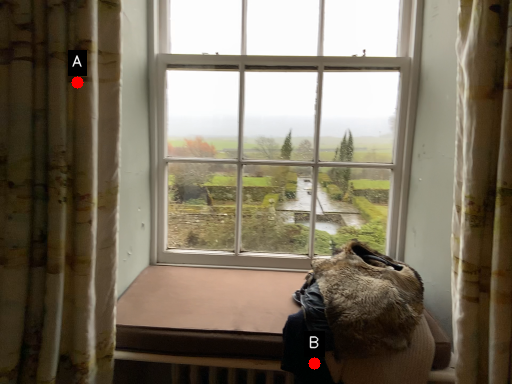
Question: Two points are circled on the image, labeled by A and B beside each circle. Which point is further to the camera?

Choices:
 (A) A is further
 (B) B is further

Answer: (B)